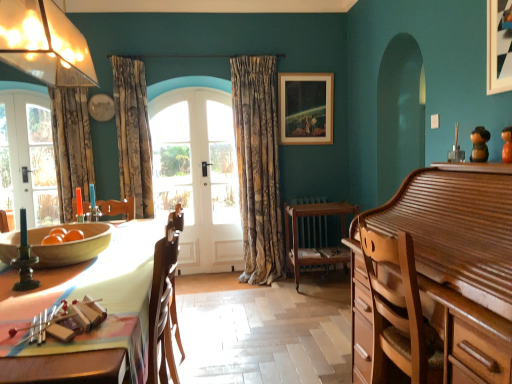
Question: Are gold-patterned fabric curtain at center, acting as the 1th curtain starting from the right, and floral fabric curtain at left, which appears as the 2th curtain when viewed from the left, located far from each other?

Choices:
 (A) no
 (B) yes

Answer: (B)

Question: Does gold-patterned fabric curtain at center, acting as the 1th curtain starting from the right, have a lesser height compared to floral fabric curtain at left, which appears as the 2th curtain when viewed from the left?

Choices:
 (A) no
 (B) yes

Answer: (A)

Question: Is gold-patterned fabric curtain at center, acting as the 1th curtain starting from the right, closer to camera compared to floral fabric curtain at left, which appears as the 2th curtain when viewed from the left?

Choices:
 (A) no
 (B) yes

Answer: (A)

Question: Is floral fabric curtain at left, which appears as the 2th curtain when viewed from the left, at the back of gold-patterned fabric curtain at center, acting as the 1th curtain starting from the right?

Choices:
 (A) yes
 (B) no

Answer: (B)

Question: From a real-world perspective, is gold-patterned fabric curtain at center, acting as the 1th curtain starting from the right, under floral fabric curtain at left, which appears as the 2th curtain when viewed from the left?

Choices:
 (A) yes
 (B) no

Answer: (A)

Question: In the image, is wooden bowl at table positioned in front of or behind wooden picture frame at upper center?

Choices:
 (A) behind
 (B) front

Answer: (B)

Question: From the image's perspective, relative to wooden picture frame at upper center, is wooden bowl at table above or below?

Choices:
 (A) above
 (B) below

Answer: (B)

Question: Which is correct: wooden bowl at table is inside wooden picture frame at upper center, or outside of it?

Choices:
 (A) outside
 (B) inside

Answer: (A)

Question: Looking at their shapes, would you say wooden bowl at table is wider or thinner than wooden picture frame at upper center?

Choices:
 (A) wide
 (B) thin

Answer: (A)

Question: Does point 90,173 appear closer or farther from the camera than point 2,16?

Choices:
 (A) closer
 (B) farther

Answer: (B)

Question: In terms of width, does floral fabric curtain at left, which appears as the 1th curtain when viewed from the left, look wider or thinner when compared to translucent glass lampshade at upper left?

Choices:
 (A) wide
 (B) thin

Answer: (A)

Question: From a real-world perspective, is floral fabric curtain at left, which appears as the 1th curtain when viewed from the left, physically located above or below translucent glass lampshade at upper left?

Choices:
 (A) below
 (B) above

Answer: (A)

Question: Is floral fabric curtain at left, which appears as the 1th curtain when viewed from the left, in front of or behind translucent glass lampshade at upper left in the image?

Choices:
 (A) behind
 (B) front

Answer: (A)

Question: From a real-world perspective, is white glass door at center positioned above or below wooden radiator at center?

Choices:
 (A) below
 (B) above

Answer: (B)

Question: Looking at the image, does white glass door at center seem bigger or smaller compared to wooden radiator at center?

Choices:
 (A) small
 (B) big

Answer: (B)